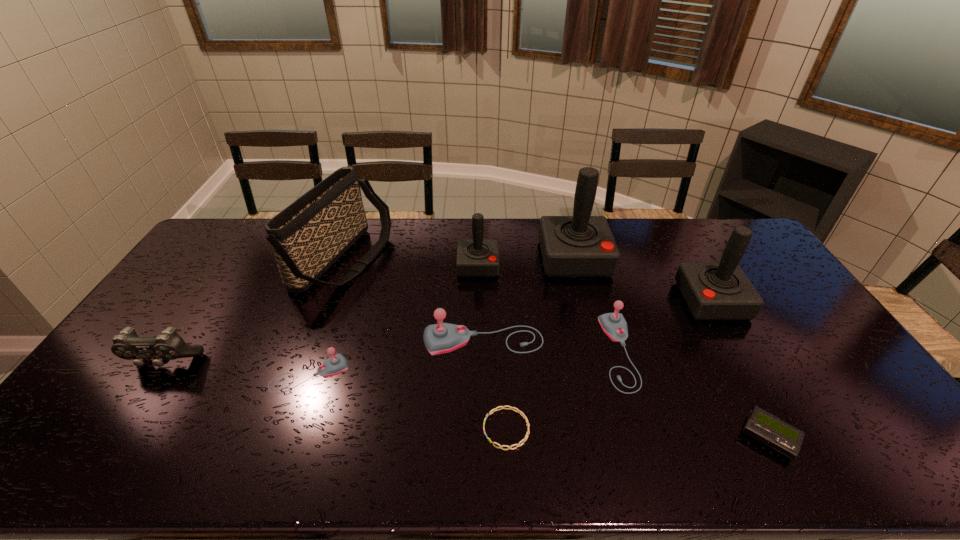
You are a GUI agent. You are given a task and a screenshot of the screen. Output one action in this format:
    pyautogui.click(x=<x>, y=<y>)
    Task: Click on the free point located on the base of the fifth shortest joystick
    The image size is (960, 540).
    Given the screenshot: What is the action you would take?
    pyautogui.click(x=595, y=301)

This screenshot has width=960, height=540. What are the coordinates of `vacant space located 0.250m on the left of the handbag` in the screenshot? It's located at (230, 261).

Locate an element on the screen. free location located on the base of the leftmost red joystick is located at coordinates (478, 314).

I want to click on vacant point located on the back of the fourth tallest joystick, so click(483, 264).

Identify the location of vacant position located on the surface of the control with buttons. Image resolution: width=960 pixels, height=540 pixels. (93, 470).

You are a GUI agent. You are given a task and a screenshot of the screen. Output one action in this format:
    pyautogui.click(x=<x>, y=<y>)
    Task: Click on the free space located on the left of the seventh tallest object
    Image resolution: width=960 pixels, height=540 pixels.
    Given the screenshot: What is the action you would take?
    pyautogui.click(x=582, y=352)

I want to click on free location located 0.090m on the front of the leftmost joystick, so (x=293, y=425).

Locate an element on the screen. The width and height of the screenshot is (960, 540). free space located 0.380m on the back of the beeper is located at coordinates (700, 307).

Locate an element on the screen. This screenshot has height=540, width=960. vacant region located on the surface of the blue bracelet showing star-shaped elements is located at coordinates (422, 429).

Identify the location of vacant space located on the surface of the blue bracelet showing star-shaped elements. (443, 429).